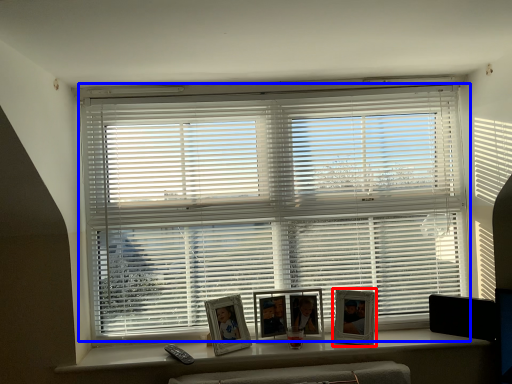
Question: Among these objects, which one is farthest to the camera, picture frame (highlighted by a red box) or window blind (highlighted by a blue box)?

Choices:
 (A) picture frame
 (B) window blind

Answer: (B)